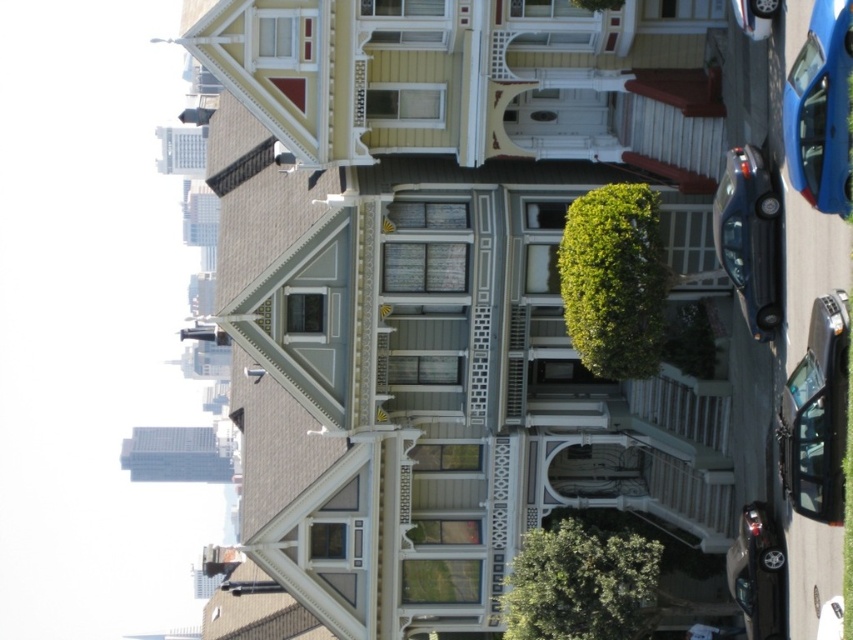
Question: Is metallic blue car at right positioned in front of metallic blue sedan at right?

Choices:
 (A) no
 (B) yes

Answer: (B)

Question: Can you confirm if shiny black car at lower right is thinner than shiny black sedan at lower right?

Choices:
 (A) yes
 (B) no

Answer: (A)

Question: Which point is closer to the camera taking this photo?

Choices:
 (A) (769, 512)
 (B) (808, 400)
 (C) (776, 282)

Answer: (B)

Question: Does metallic blue car at right have a greater width compared to shiny black sedan at lower right?

Choices:
 (A) no
 (B) yes

Answer: (A)

Question: Which object is farther from the camera taking this photo?

Choices:
 (A) shiny black sedan at lower right
 (B) metallic blue car at right

Answer: (A)

Question: Among these objects, which one is farthest from the camera?

Choices:
 (A) metallic blue car at right
 (B) shiny black car at lower right

Answer: (B)